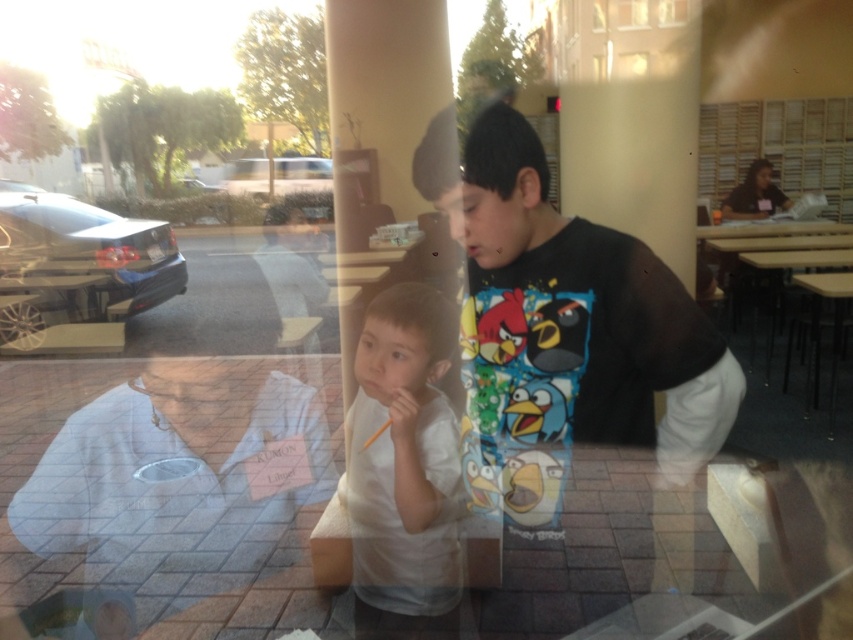
Question: Among these objects, which one is nearest to the camera?

Choices:
 (A) white matte shirt at center
 (B) white fabric at left

Answer: (A)

Question: Can you confirm if white fabric at left is positioned to the right of white matte shirt at center?

Choices:
 (A) yes
 (B) no

Answer: (B)

Question: Which point is farther to the camera?

Choices:
 (A) white matte shirt at center
 (B) white fabric at left

Answer: (B)

Question: Is white fabric at left to the right of white matte shirt at center from the viewer's perspective?

Choices:
 (A) no
 (B) yes

Answer: (A)

Question: Can you confirm if white fabric at left is wider than white matte shirt at center?

Choices:
 (A) no
 (B) yes

Answer: (B)